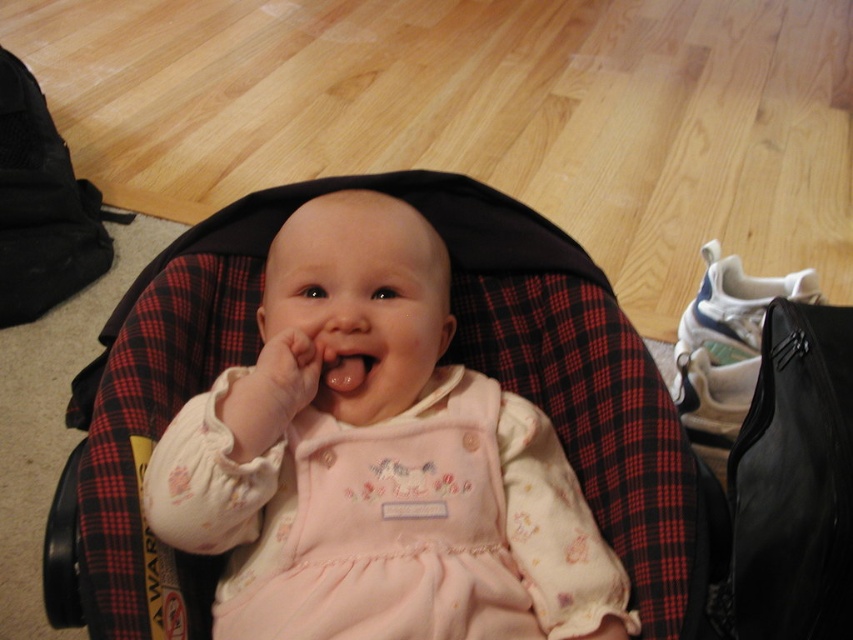
Question: Can you confirm if pink fabric baby at center is positioned above pink matte/satin mouth at center?

Choices:
 (A) yes
 (B) no

Answer: (B)

Question: Which point appears closest to the camera in this image?

Choices:
 (A) (257, 356)
 (B) (364, 381)

Answer: (B)

Question: Is pink fabric baby at center wider than pink matte/satin mouth at center?

Choices:
 (A) yes
 (B) no

Answer: (A)

Question: Can you confirm if pink fabric baby at center is thinner than pink matte/satin mouth at center?

Choices:
 (A) no
 (B) yes

Answer: (A)